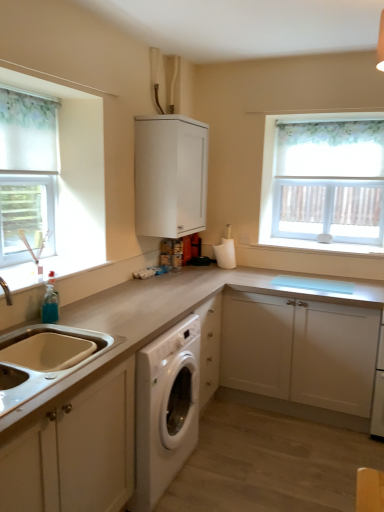
Question: From a real-world perspective, is white matte cabinet at center, which is the second cabinetry from front to back, above or below white matte sink at lower left, acting as the 3th cabinetry starting from the back?

Choices:
 (A) above
 (B) below

Answer: (B)

Question: In the image, is white matte cabinet at center, arranged as the 3th cabinetry when viewed from the top, on the left side or the right side of white matte sink at lower left, which is the second cabinetry from top to bottom?

Choices:
 (A) right
 (B) left

Answer: (A)

Question: Estimate the real-world distances between objects in this image. Which object is closer to the white textured curtain at upper right?

Choices:
 (A) white matte toilet paper holder at center
 (B) white matte cabinet at upper center, the 3th cabinetry in the front-to-back sequence
 (C) white matte cabinet at center, arranged as the second cabinetry when viewed from the back
 (D) white fabric curtain at left
 (E) white matte sink at lower left, marked as the third cabinetry in a right-to-left arrangement

Answer: (A)

Question: Estimate the real-world distances between objects in this image. Which object is closer to the white matte cabinet at center, arranged as the second cabinetry when viewed from the back?

Choices:
 (A) white matte cabinet at upper center, the 3th cabinetry in the front-to-back sequence
 (B) white matte sink at lower left, marked as the third cabinetry in a right-to-left arrangement
 (C) white matte toilet paper holder at center
 (D) white fabric curtain at left
 (E) white textured curtain at upper right

Answer: (C)